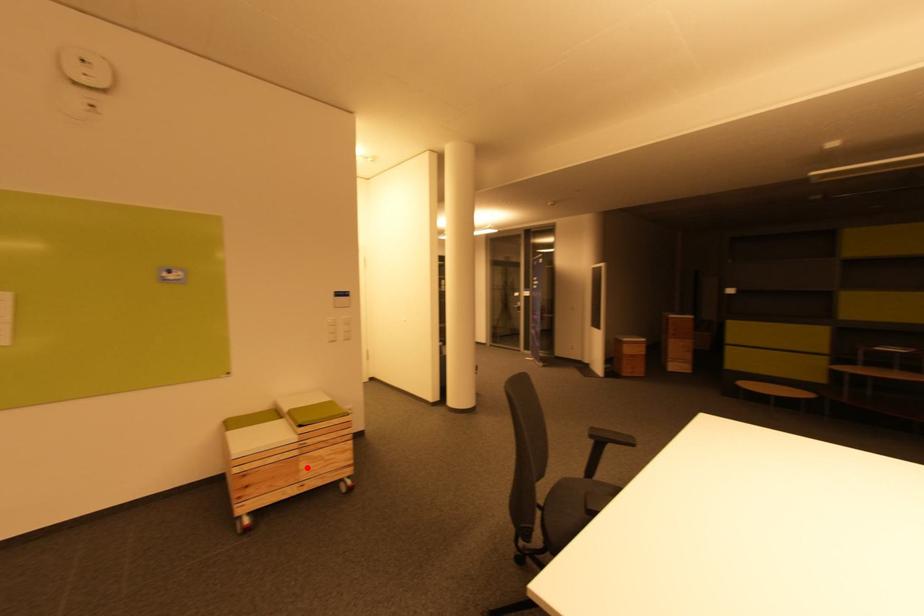
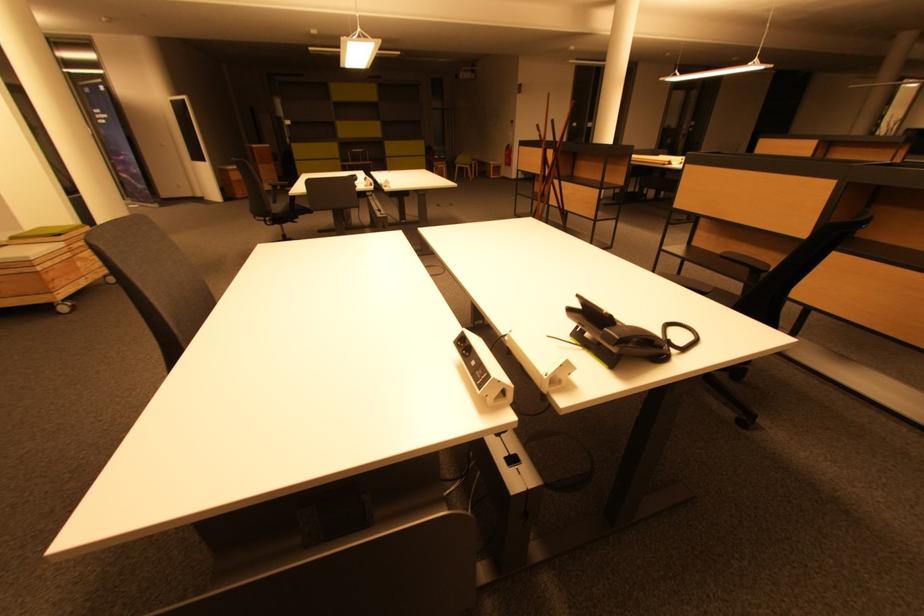
In the second image, find the point that corresponds to the highlighted location in the first image.

(83, 265)